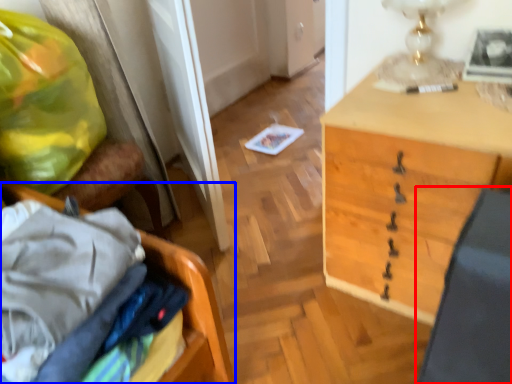
Question: Which point is further to the camera, swivel chair (highlighted by a red box) or furniture (highlighted by a blue box)?

Choices:
 (A) swivel chair
 (B) furniture

Answer: (B)